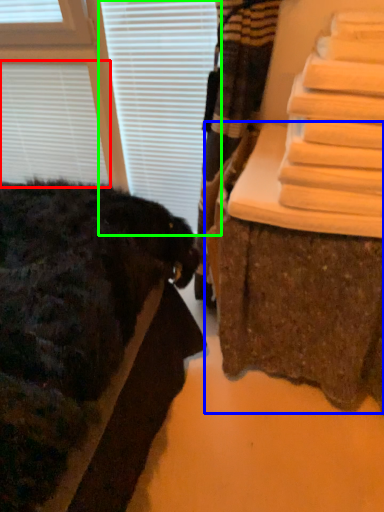
Question: Based on their relative distances, which object is nearer to blind (highlighted by a red box)? Choose from furniture (highlighted by a blue box) and blind (highlighted by a green box).

Choices:
 (A) furniture
 (B) blind

Answer: (B)